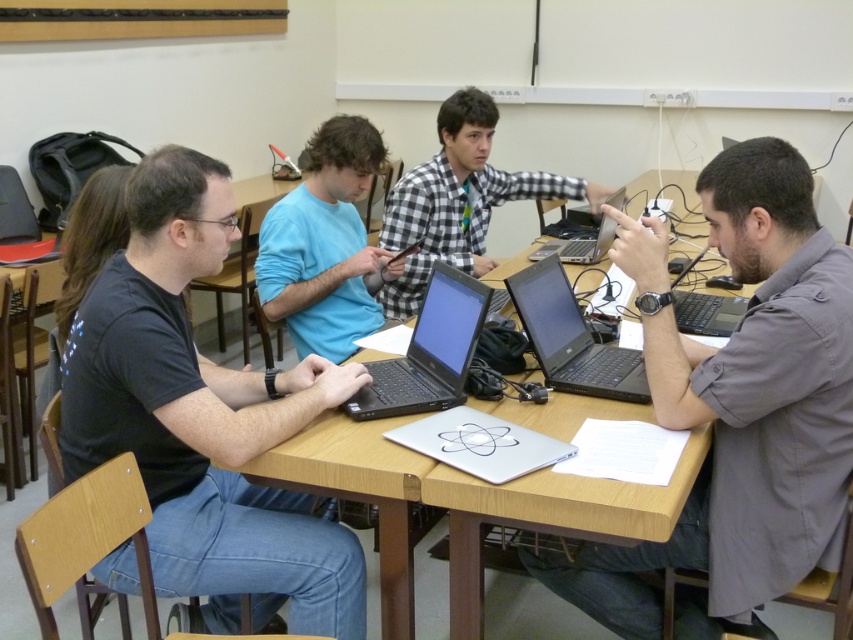
Question: Which object is the farthest from the matte blue shirt at center?

Choices:
 (A) satin black laptop at center
 (B) silver metallic laptop at center
 (C) gray matte shirt at right

Answer: (C)

Question: Which object is the farthest from the wooden table at center?

Choices:
 (A) checkered fabric shirt at center
 (B) matte blue shirt at center
 (C) black matte laptop at center

Answer: (A)

Question: Does gray matte shirt at right come behind satin black laptop at right?

Choices:
 (A) no
 (B) yes

Answer: (A)

Question: Can you confirm if checkered fabric shirt at center is positioned to the right of silver metallic laptop at center?

Choices:
 (A) yes
 (B) no

Answer: (B)

Question: Which of the following is the farthest from the observer?

Choices:
 (A) (364, 464)
 (B) (608, 230)
 (C) (631, 275)

Answer: (B)

Question: Does matte blue shirt at center have a lesser width compared to checkered fabric shirt at center?

Choices:
 (A) yes
 (B) no

Answer: (A)